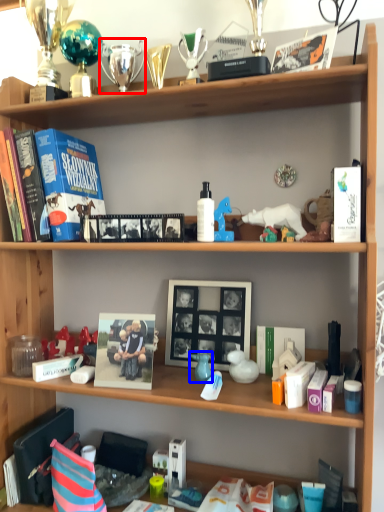
Question: Among these objects, which one is farthest to the camera, toy (highlighted by a red box) or toy (highlighted by a blue box)?

Choices:
 (A) toy
 (B) toy

Answer: (A)